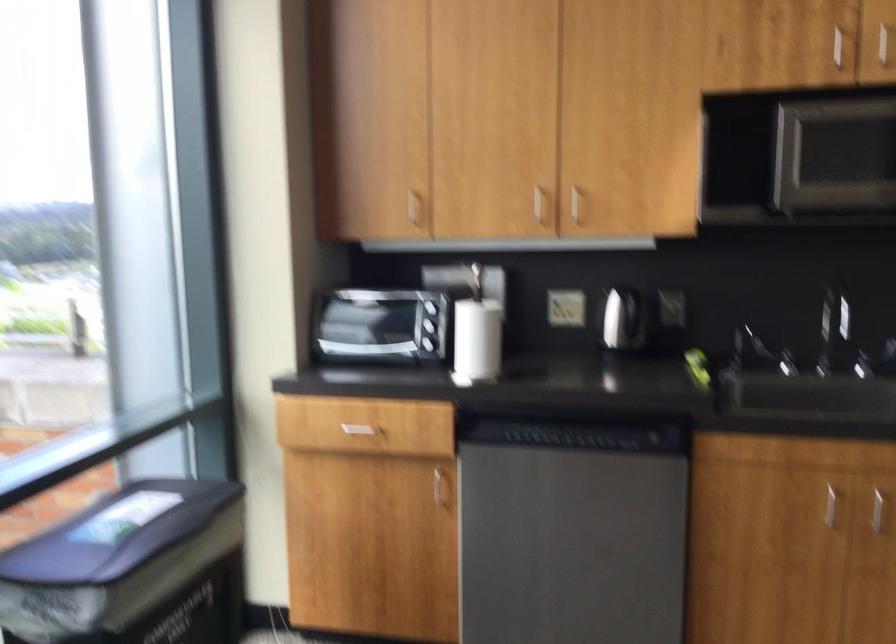
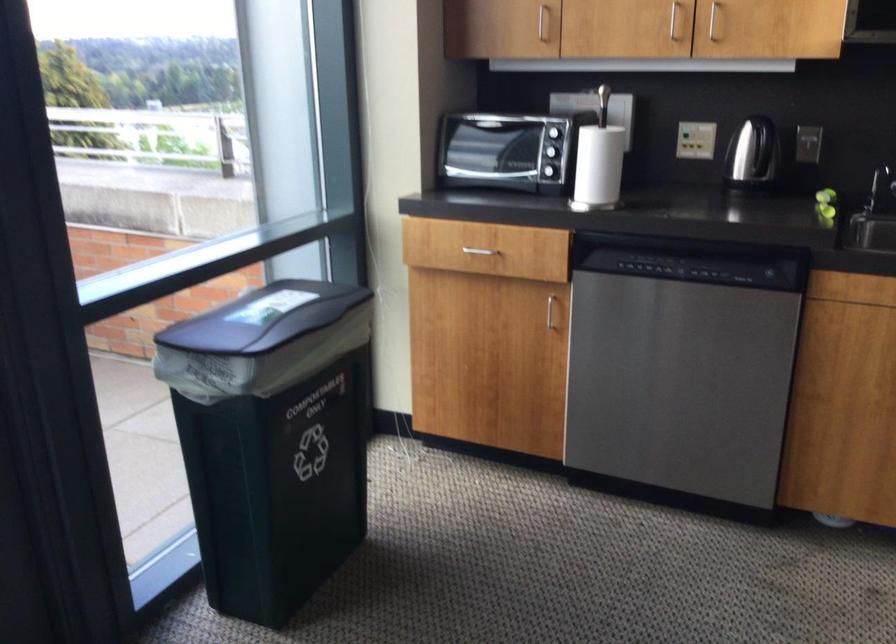
Locate, in the second image, the point that corresponds to [441,491] in the first image.

(549, 310)